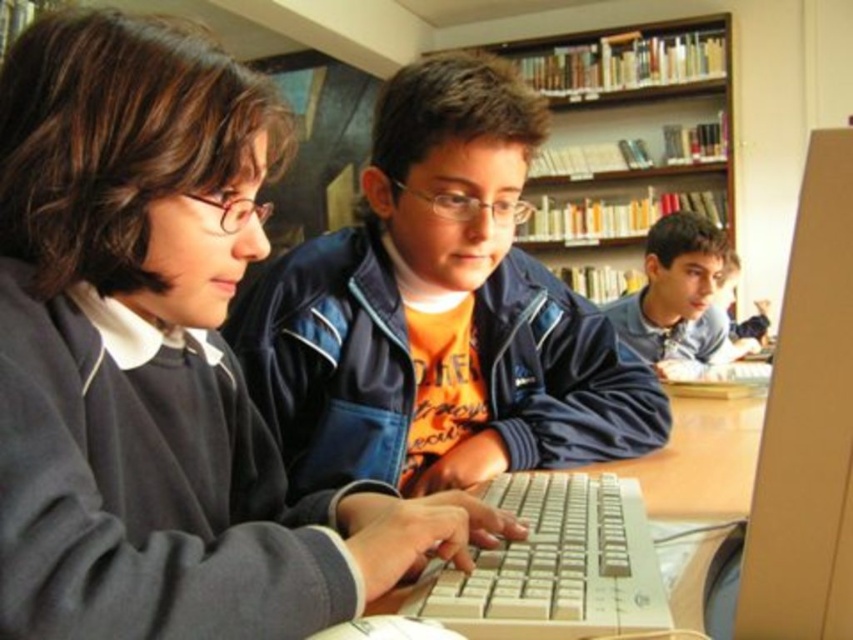
You are a robot with a 2.5 feet wide arm. You need to reach from the matte black keyboard at center to the blue denim jacket at upper right. Can your arm fit through the space between them?

The distance between the matte black keyboard at center and the blue denim jacket at upper right is 5.77 feet. Since your arm is only 2.5 feet wide, it can easily fit through the space between them.

You are a student who needs to reach a book on the wooden bookshelf at upper center. You are standing 1.5 meters away from the bookshelf. Can you just reach it without moving closer?

The wooden bookshelf at upper center is 4.16 meters away from the camera, so if you are standing 1.5 meters away from it, you are actually 1.5 meters away from the bookshelf, which is much closer than the camera distance. Therefore, you can easily reach the book without needing to move closer.

You are a robot navigating the library. You need to move from the starting point to the endpoint. The starting point is at coordinate point (689, 128) and the endpoint is at coordinate point (560, 497). According to the scene description, is the starting point behind the endpoint?

Yes, according to the objects description, point (689, 128) is behind point (560, 497), so the starting point is indeed behind the endpoint.